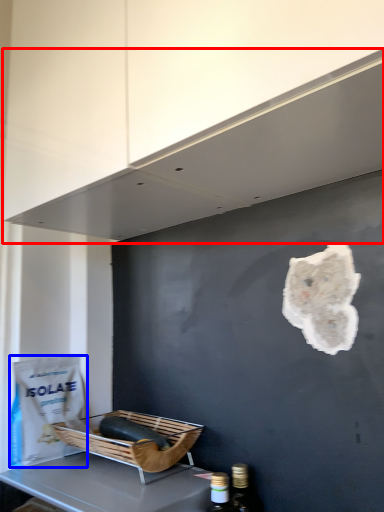
Question: Which object appears farthest to the camera in this image, exhaust hood (highlighted by a red box) or paper bag (highlighted by a blue box)?

Choices:
 (A) exhaust hood
 (B) paper bag

Answer: (B)